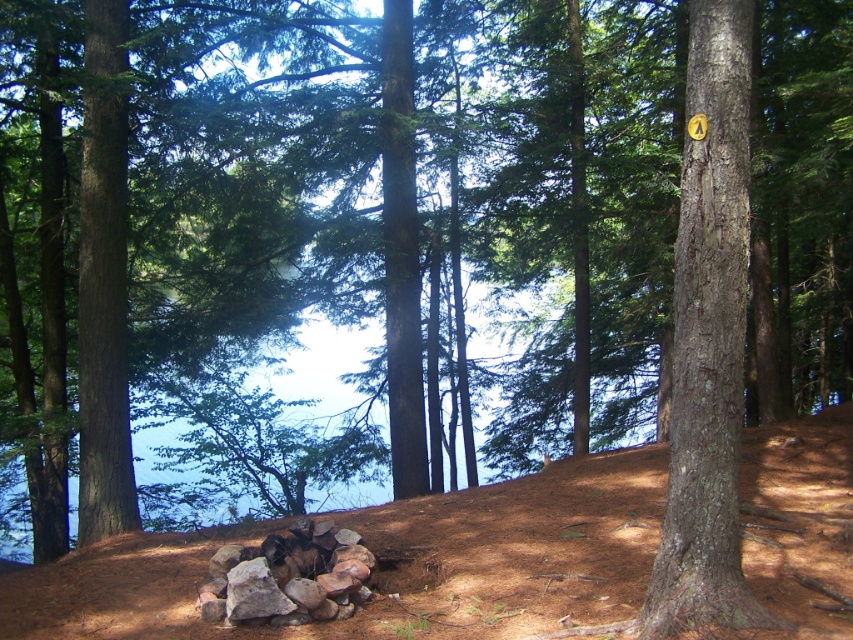
Who is lower down, brown dirt hillside at center or rusty metallic rocks at center?

Positioned lower is rusty metallic rocks at center.

Find the location of a particular element. brown dirt hillside at center is located at coordinates (393, 563).

The width and height of the screenshot is (853, 640). What are the coordinates of `brown dirt hillside at center` in the screenshot? It's located at (393, 563).

Is smooth brown tree trunk at right to the left of rusty metallic rocks at center from the viewer's perspective?

No, smooth brown tree trunk at right is not to the left of rusty metallic rocks at center.

Is smooth brown tree trunk at right wider than rusty metallic rocks at center?

Incorrect, smooth brown tree trunk at right's width does not surpass rusty metallic rocks at center's.

Does point (723, 256) come in front of point (306, 561)?

Yes, it is.

This screenshot has width=853, height=640. Find the location of `smooth brown tree trunk at right`. smooth brown tree trunk at right is located at coordinates (708, 340).

Does point (39, 620) lie behind point (734, 280)?

Yes.

Looking at this image, is brown dirt hillside at center to the right of smooth brown tree trunk at right from the viewer's perspective?

Correct, you'll find brown dirt hillside at center to the right of smooth brown tree trunk at right.

Does point (146, 572) come behind point (699, 468)?

Yes, point (146, 572) is behind point (699, 468).

You are a GUI agent. You are given a task and a screenshot of the screen. Output one action in this format:
    pyautogui.click(x=<x>, y=<y>)
    Task: Click on the brown dirt hillside at center
    
    Given the screenshot: What is the action you would take?
    pyautogui.click(x=393, y=563)